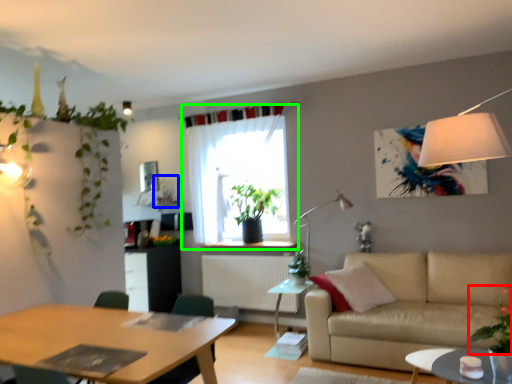
Question: Which object is positioned closest to plant (highlighted by a red box)? Select from plant (highlighted by a blue box) and curtain (highlighted by a green box).

Choices:
 (A) plant
 (B) curtain

Answer: (B)